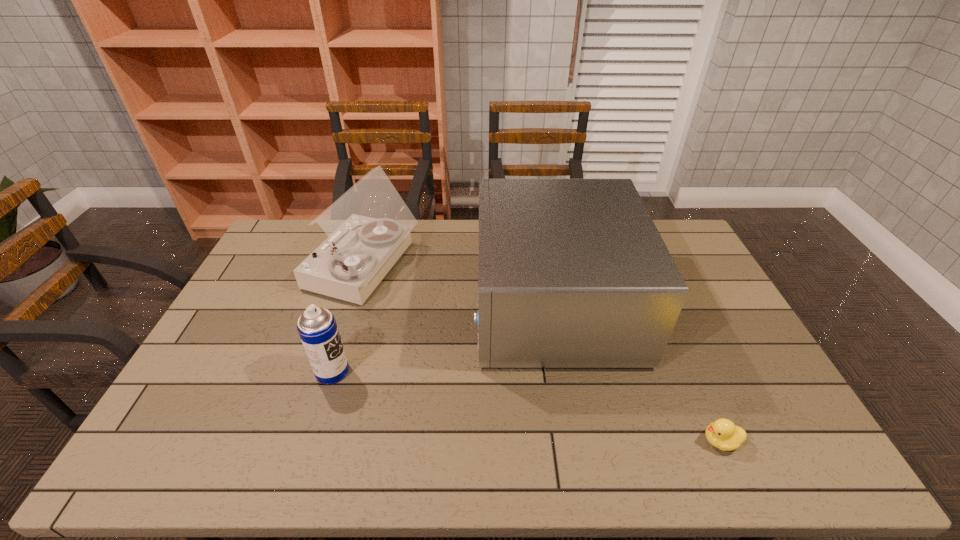
Locate an element on the screen. object identified as the third closest to the record player is located at coordinates (722, 433).

You are a GUI agent. You are given a task and a screenshot of the screen. Output one action in this format:
    pyautogui.click(x=<x>, y=<y>)
    Task: Click on the object that is the closest to the nearest object
    The width and height of the screenshot is (960, 540).
    Given the screenshot: What is the action you would take?
    pyautogui.click(x=573, y=273)